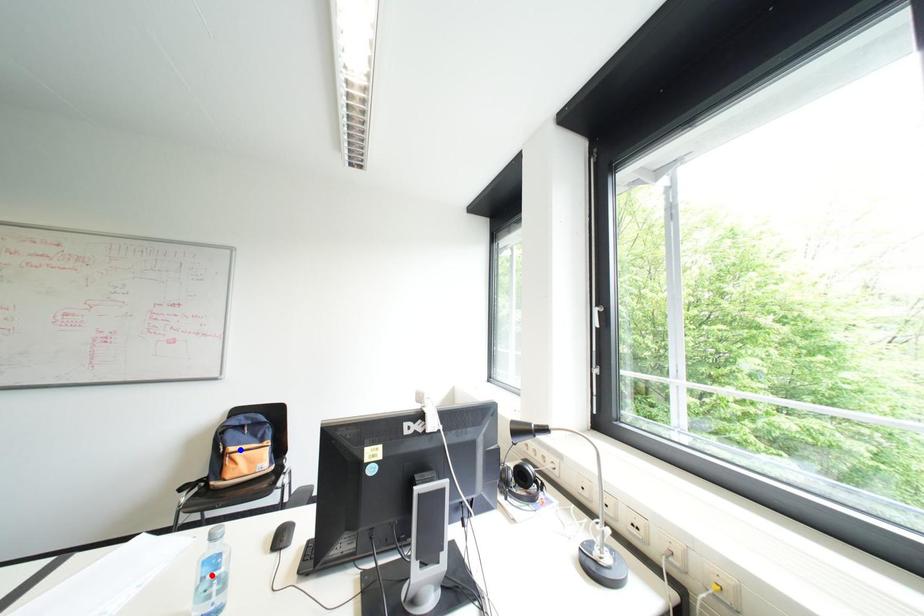
Question: Which of the two points in the image is closer to the camera?

Choices:
 (A) Blue point is closer.
 (B) Red point is closer.

Answer: (B)